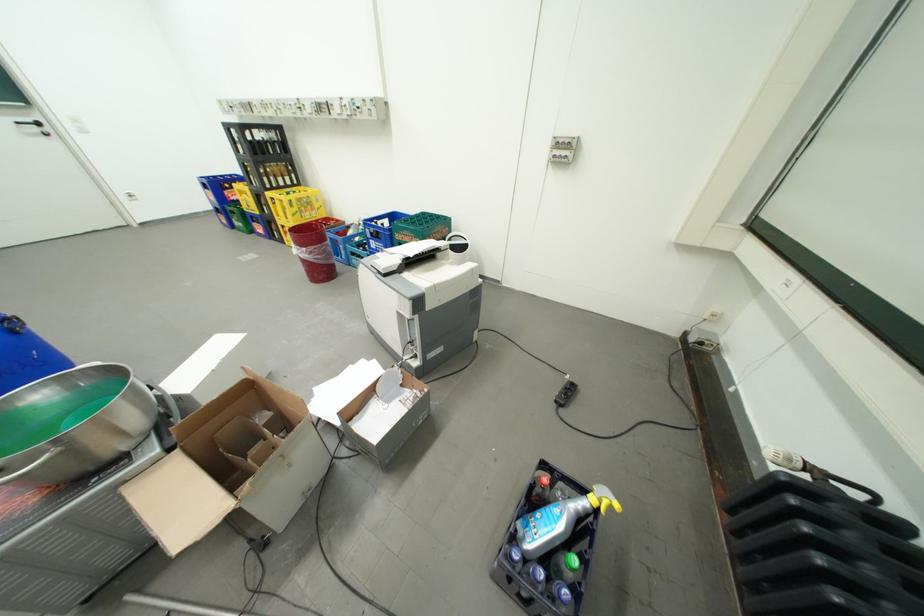
The image size is (924, 616). Find the location of `green plastic crate`. green plastic crate is located at coordinates (429, 225).